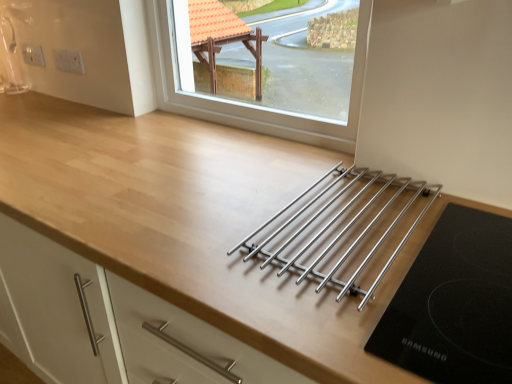
Question: From a real-world perspective, is clear glass window at upper center on white plastic electrical outlet at upper left, arranged as the first electric outlet when viewed from the left?

Choices:
 (A) yes
 (B) no

Answer: (A)

Question: Is clear glass window at upper center behind white plastic electrical outlet at upper left, which is counted as the 1th electric outlet, starting from the back?

Choices:
 (A) no
 (B) yes

Answer: (A)

Question: Are clear glass window at upper center and white plastic electrical outlet at upper left, arranged as the second electric outlet when viewed from the right, making contact?

Choices:
 (A) no
 (B) yes

Answer: (A)

Question: Is there a large distance between clear glass window at upper center and white plastic electrical outlet at upper left, which is counted as the 1th electric outlet, starting from the back?

Choices:
 (A) no
 (B) yes

Answer: (A)

Question: From the image's perspective, is clear glass window at upper center below white plastic electrical outlet at upper left, which is counted as the 1th electric outlet, starting from the back?

Choices:
 (A) yes
 (B) no

Answer: (A)

Question: From the image's perspective, is clear glass window at upper center above or below white plastic electric outlet at upper left, the second electric outlet viewed from the left?

Choices:
 (A) above
 (B) below

Answer: (B)

Question: From a real-world perspective, is clear glass window at upper center above or below white plastic electric outlet at upper left, the second electric outlet in the back-to-front sequence?

Choices:
 (A) above
 (B) below

Answer: (A)

Question: Visually, is clear glass window at upper center positioned to the left or to the right of white plastic electric outlet at upper left, the second electric outlet in the back-to-front sequence?

Choices:
 (A) right
 (B) left

Answer: (A)

Question: In terms of size, does clear glass window at upper center appear bigger or smaller than white plastic electric outlet at upper left, the first electric outlet in the right-to-left sequence?

Choices:
 (A) small
 (B) big

Answer: (B)

Question: Visually, is clear glass window at upper center positioned to the left or to the right of white plastic electrical outlet at upper left, the 2th electric outlet from the front?

Choices:
 (A) right
 (B) left

Answer: (A)

Question: From a real-world perspective, relative to white plastic electrical outlet at upper left, the 2th electric outlet from the front, is clear glass window at upper center vertically above or below?

Choices:
 (A) above
 (B) below

Answer: (A)

Question: Is clear glass window at upper center inside or outside of white plastic electrical outlet at upper left, which is counted as the 1th electric outlet, starting from the back?

Choices:
 (A) inside
 (B) outside

Answer: (B)

Question: From the image's perspective, is clear glass window at upper center located above or below white plastic electrical outlet at upper left, which is counted as the 1th electric outlet, starting from the back?

Choices:
 (A) below
 (B) above

Answer: (A)

Question: Looking at the image, does white plastic electric outlet at upper left, the second electric outlet viewed from the left, seem bigger or smaller compared to white plastic electrical outlet at upper left, arranged as the first electric outlet when viewed from the left?

Choices:
 (A) big
 (B) small

Answer: (B)

Question: Considering the relative positions of white plastic electric outlet at upper left, placed as the first electric outlet when sorted from front to back, and white plastic electrical outlet at upper left, arranged as the first electric outlet when viewed from the left, in the image provided, is white plastic electric outlet at upper left, placed as the first electric outlet when sorted from front to back, to the left or to the right of white plastic electrical outlet at upper left, arranged as the first electric outlet when viewed from the left,?

Choices:
 (A) left
 (B) right

Answer: (B)